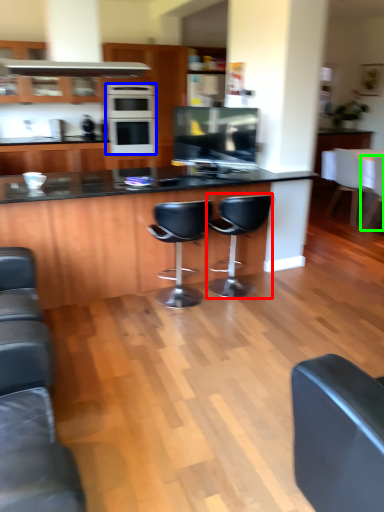
Question: Which is nearer to the chair (highlighted by a red box)? kitchen appliance (highlighted by a blue box) or chair (highlighted by a green box).

Choices:
 (A) kitchen appliance
 (B) chair

Answer: (A)